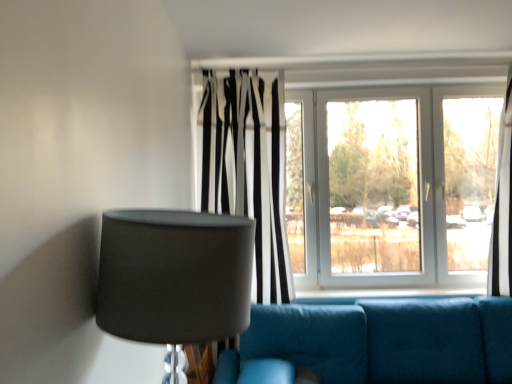
Question: Are matte gray lampshade at left and black and white striped curtain at center beside each other?

Choices:
 (A) no
 (B) yes

Answer: (A)

Question: From a real-world perspective, is matte gray lampshade at left under black and white striped curtain at center?

Choices:
 (A) no
 (B) yes

Answer: (B)

Question: From a real-world perspective, is matte gray lampshade at left on top of black and white striped curtain at center?

Choices:
 (A) no
 (B) yes

Answer: (A)

Question: Is matte gray lampshade at left wider than black and white striped curtain at center?

Choices:
 (A) yes
 (B) no

Answer: (A)

Question: Is black and white striped curtain at center at the back of matte gray lampshade at left?

Choices:
 (A) yes
 (B) no

Answer: (B)

Question: Considering the relative sizes of matte gray lampshade at left and black and white striped curtain at center in the image provided, is matte gray lampshade at left shorter than black and white striped curtain at center?

Choices:
 (A) yes
 (B) no

Answer: (A)

Question: From the image's perspective, would you say teal fabric couch at lower center is shown under matte gray lampshade at left?

Choices:
 (A) no
 (B) yes

Answer: (B)

Question: Does teal fabric couch at lower center appear on the left side of matte gray lampshade at left?

Choices:
 (A) no
 (B) yes

Answer: (A)

Question: Is the depth of teal fabric couch at lower center greater than that of matte gray lampshade at left?

Choices:
 (A) yes
 (B) no

Answer: (A)

Question: Is teal fabric couch at lower center to the right of matte gray lampshade at left from the viewer's perspective?

Choices:
 (A) yes
 (B) no

Answer: (A)

Question: From a real-world perspective, is teal fabric couch at lower center physically above matte gray lampshade at left?

Choices:
 (A) yes
 (B) no

Answer: (B)

Question: Is teal fabric couch at lower center positioned in front of matte gray lampshade at left?

Choices:
 (A) yes
 (B) no

Answer: (B)

Question: Is white glossy window at center behind teal fabric couch at lower center?

Choices:
 (A) yes
 (B) no

Answer: (A)